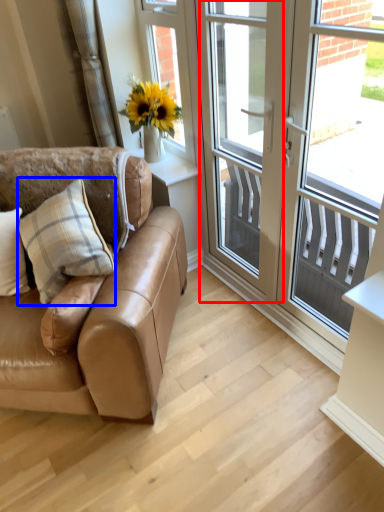
Question: Which point is closer to the camera, screen door (highlighted by a red box) or pillow (highlighted by a blue box)?

Choices:
 (A) screen door
 (B) pillow

Answer: (A)